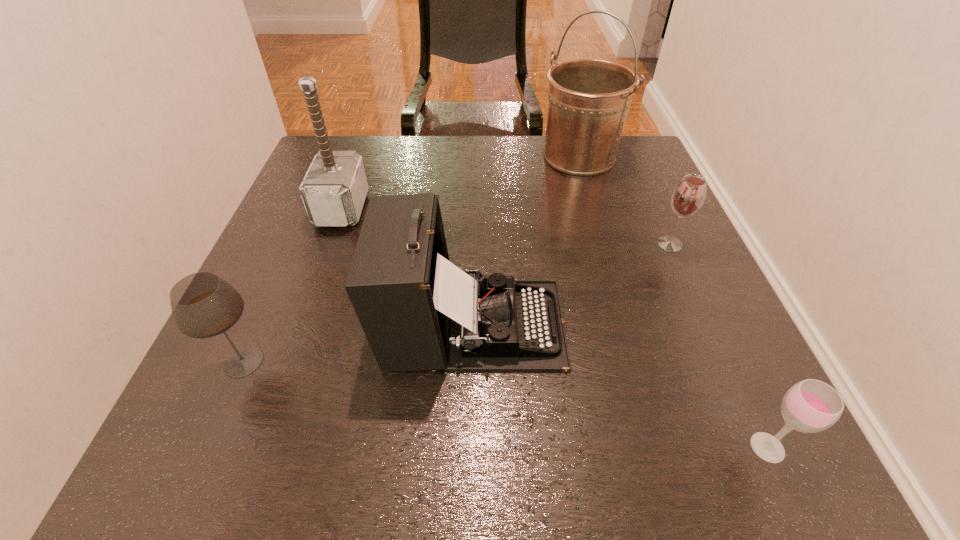
Locate an element on the screen. The height and width of the screenshot is (540, 960). free space in the image that satisfies the following two spatial constraints: 1. inside the open case of the nearest object; 2. on the left side of the third object from left to right is located at coordinates (470, 447).

Find the location of a particular element. Image resolution: width=960 pixels, height=540 pixels. free space that satisfies the following two spatial constraints: 1. inside the open case of the third tallest object; 2. on the front side of the leftmost wineglass is located at coordinates (472, 361).

This screenshot has height=540, width=960. Identify the location of vacant space that satisfies the following two spatial constraints: 1. inside the open case of the nearest object; 2. on the right side of the third object from left to right. (470, 447).

The image size is (960, 540). Identify the location of free space that satisfies the following two spatial constraints: 1. on the front side of the second nearest wineglass; 2. on the right side of the nearest object. (206, 447).